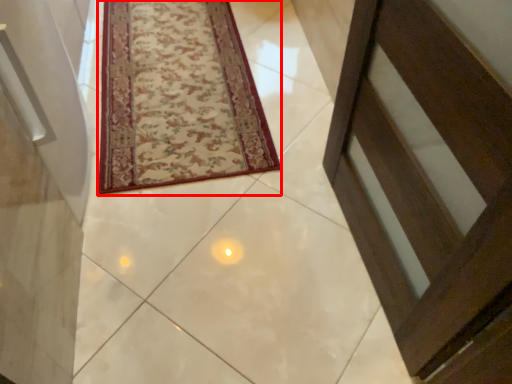
Question: From the image's perspective, considering the relative positions of mat (annotated by the red box) and path in the image provided, where is mat (annotated by the red box) located with respect to the staircase?

Choices:
 (A) above
 (B) below

Answer: (A)